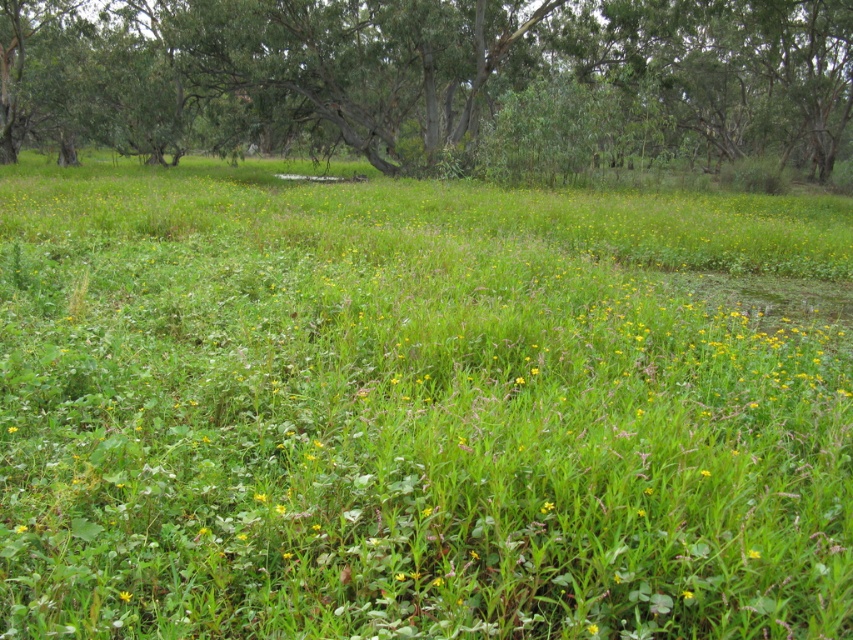
Question: Which point is closer to the camera taking this photo?

Choices:
 (A) (126, 595)
 (B) (403, 24)

Answer: (A)

Question: Does green leafy tree at center appear on the right side of yellow matte flower at center?

Choices:
 (A) no
 (B) yes

Answer: (B)

Question: Is the position of green leafy tree at center more distant than that of yellow matte flower at center?

Choices:
 (A) yes
 (B) no

Answer: (A)

Question: Can you confirm if green leafy tree at center is positioned below yellow matte flower at center?

Choices:
 (A) yes
 (B) no

Answer: (B)

Question: Which point is farther to the camera?

Choices:
 (A) (207, 45)
 (B) (125, 592)

Answer: (A)

Question: Among these points, which one is nearest to the camera?

Choices:
 (A) (126, 595)
 (B) (830, 104)

Answer: (A)